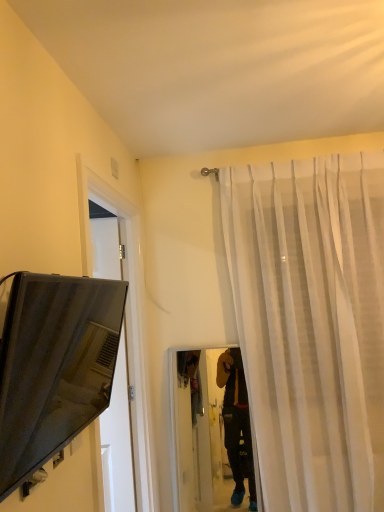
Question: Is white sheer curtain at upper right at the right side of matte black tv at left?

Choices:
 (A) yes
 (B) no

Answer: (A)

Question: Would you consider white sheer curtain at upper right to be distant from matte black tv at left?

Choices:
 (A) no
 (B) yes

Answer: (B)

Question: From the image's perspective, would you say white sheer curtain at upper right is shown under matte black tv at left?

Choices:
 (A) no
 (B) yes

Answer: (B)

Question: From a real-world perspective, is white sheer curtain at upper right physically above matte black tv at left?

Choices:
 (A) yes
 (B) no

Answer: (B)

Question: Is white sheer curtain at upper right wider than matte black tv at left?

Choices:
 (A) yes
 (B) no

Answer: (A)

Question: Is white sheer curtain at upper right aimed at matte black tv at left?

Choices:
 (A) no
 (B) yes

Answer: (A)

Question: Is matte black tv at left outside of white sheer curtain at upper right?

Choices:
 (A) no
 (B) yes

Answer: (B)

Question: From the image's perspective, would you say matte black tv at left is shown under white sheer curtain at upper right?

Choices:
 (A) yes
 (B) no

Answer: (B)

Question: From a real-world perspective, is matte black tv at left positioned over white sheer curtain at upper right based on gravity?

Choices:
 (A) no
 (B) yes

Answer: (B)

Question: From the image's perspective, is matte black tv at left above white sheer curtain at upper right?

Choices:
 (A) no
 (B) yes

Answer: (B)

Question: Is matte black tv at left closer to the viewer compared to white sheer curtain at upper right?

Choices:
 (A) no
 (B) yes

Answer: (B)

Question: Can you confirm if matte black tv at left is shorter than white sheer curtain at upper right?

Choices:
 (A) no
 (B) yes

Answer: (B)

Question: Is white sheer curtain at upper right taller or shorter than matte black tv at left?

Choices:
 (A) short
 (B) tall

Answer: (B)